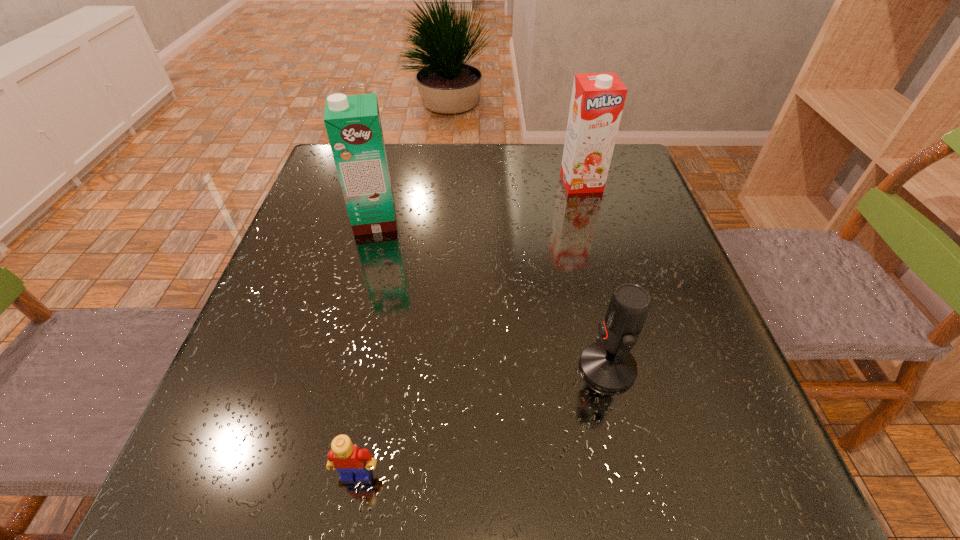
Find the location of a particular element. free space located 0.380m on the side of the third farthest object with the red ring is located at coordinates (361, 367).

You are a GUI agent. You are given a task and a screenshot of the screen. Output one action in this format:
    pyautogui.click(x=<x>, y=<y>)
    Task: Click on the free space located on the side of the third farthest object with the red ring
    The height and width of the screenshot is (540, 960).
    Given the screenshot: What is the action you would take?
    pyautogui.click(x=528, y=367)

The height and width of the screenshot is (540, 960). Find the location of `vacant space located 0.060m on the side of the third farthest object with the red ring`. vacant space located 0.060m on the side of the third farthest object with the red ring is located at coordinates (545, 367).

Locate an element on the screen. This screenshot has height=540, width=960. object that is at the far edge is located at coordinates (597, 101).

In order to click on object that is at the near edge in this screenshot , I will do `click(349, 460)`.

Identify the location of object present at the left edge. (353, 124).

At what (x,y) coordinates should I click in order to perform the action: click on carton located at the right edge. Please return your answer as a coordinate pair (x, y). Looking at the image, I should click on (597, 101).

Locate an element on the screen. The width and height of the screenshot is (960, 540). microphone that is positioned at the right edge is located at coordinates (608, 365).

Image resolution: width=960 pixels, height=540 pixels. Identify the location of object that is at the far right corner. (597, 101).

Where is `vacant space at the far edge of the desktop`? The image size is (960, 540). vacant space at the far edge of the desktop is located at coordinates (446, 177).